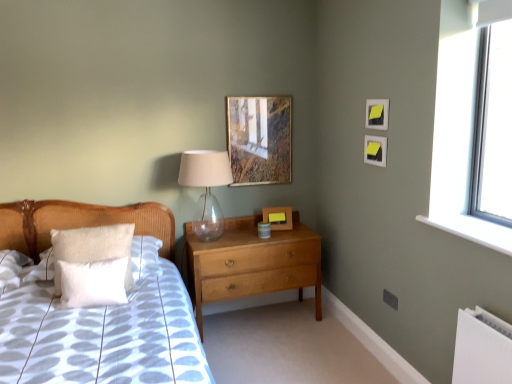
Question: Would you say transparent plastic window screen at upper right is part of white fluffy pillow at left, the first pillow when ordered from front to back,'s contents?

Choices:
 (A) no
 (B) yes

Answer: (A)

Question: Does white fluffy pillow at left, marked as the second pillow in a back-to-front arrangement, appear on the left side of transparent plastic window screen at upper right?

Choices:
 (A) yes
 (B) no

Answer: (A)

Question: Is white fluffy pillow at left, the first pillow when ordered from front to back, looking in the opposite direction of transparent plastic window screen at upper right?

Choices:
 (A) yes
 (B) no

Answer: (B)

Question: From the image's perspective, is white fluffy pillow at left, marked as the second pillow in a back-to-front arrangement, over transparent plastic window screen at upper right?

Choices:
 (A) no
 (B) yes

Answer: (A)

Question: Is the position of white fluffy pillow at left, the first pillow when ordered from front to back, more distant than that of transparent plastic window screen at upper right?

Choices:
 (A) yes
 (B) no

Answer: (A)

Question: Do you think white fluffy pillow at left, which is counted as the second pillow, starting from the front, is within white fluffy pillow at left, the first pillow when ordered from front to back, or outside of it?

Choices:
 (A) inside
 (B) outside

Answer: (B)

Question: From the image's perspective, relative to white fluffy pillow at left, the first pillow when ordered from front to back, is white fluffy pillow at left, which is counted as the second pillow, starting from the front, above or below?

Choices:
 (A) below
 (B) above

Answer: (B)

Question: In terms of size, does white fluffy pillow at left, which ranks as the first pillow in back-to-front order, appear bigger or smaller than white fluffy pillow at left, the first pillow when ordered from front to back?

Choices:
 (A) big
 (B) small

Answer: (A)

Question: From a real-world perspective, relative to white fluffy pillow at left, the first pillow when ordered from front to back, is white fluffy pillow at left, which ranks as the first pillow in back-to-front order, vertically above or below?

Choices:
 (A) below
 (B) above

Answer: (B)

Question: From a real-world perspective, is white fluffy pillow at left, the first pillow when ordered from front to back, positioned above or below yellow paper picture frame at upper right, acting as the first picture frame starting from the right?

Choices:
 (A) above
 (B) below

Answer: (B)

Question: Do you think white fluffy pillow at left, marked as the second pillow in a back-to-front arrangement, is within yellow paper picture frame at upper right, acting as the first picture frame starting from the right, or outside of it?

Choices:
 (A) outside
 (B) inside

Answer: (A)

Question: From the image's perspective, relative to yellow paper picture frame at upper right, arranged as the 2th picture frame when viewed from the front, is white fluffy pillow at left, marked as the second pillow in a back-to-front arrangement, above or below?

Choices:
 (A) below
 (B) above

Answer: (A)

Question: Based on their sizes in the image, would you say white fluffy pillow at left, marked as the second pillow in a back-to-front arrangement, is bigger or smaller than yellow paper picture frame at upper right, the 3th picture frame positioned from the back?

Choices:
 (A) small
 (B) big

Answer: (B)

Question: Visually, is wooden picture frame at upper center, which is the 1th picture frame from left to right, positioned to the left or to the right of matte yellow picture frame at upper right, which is counted as the third picture frame, starting from the left?

Choices:
 (A) right
 (B) left

Answer: (B)

Question: Is point (256, 139) closer or farther from the camera than point (376, 109)?

Choices:
 (A) farther
 (B) closer

Answer: (A)